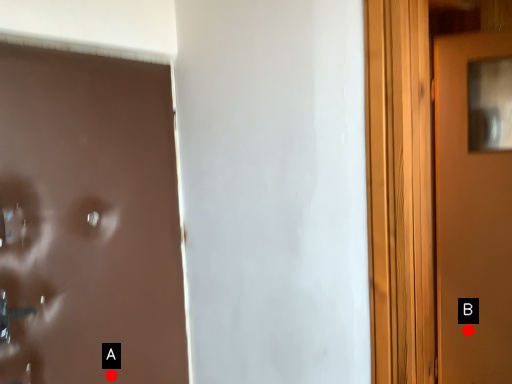
Question: Two points are circled on the image, labeled by A and B beside each circle. Which point is closer to the camera?

Choices:
 (A) A is closer
 (B) B is closer

Answer: (A)